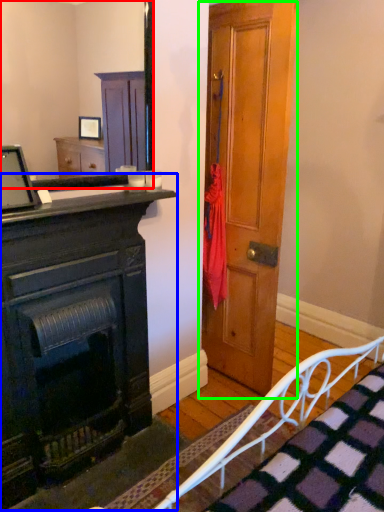
Question: Which object is positioned farthest from mirror (highlighted by a red box)? Select from chest of drawers (highlighted by a blue box) and door (highlighted by a green box).

Choices:
 (A) chest of drawers
 (B) door

Answer: (A)